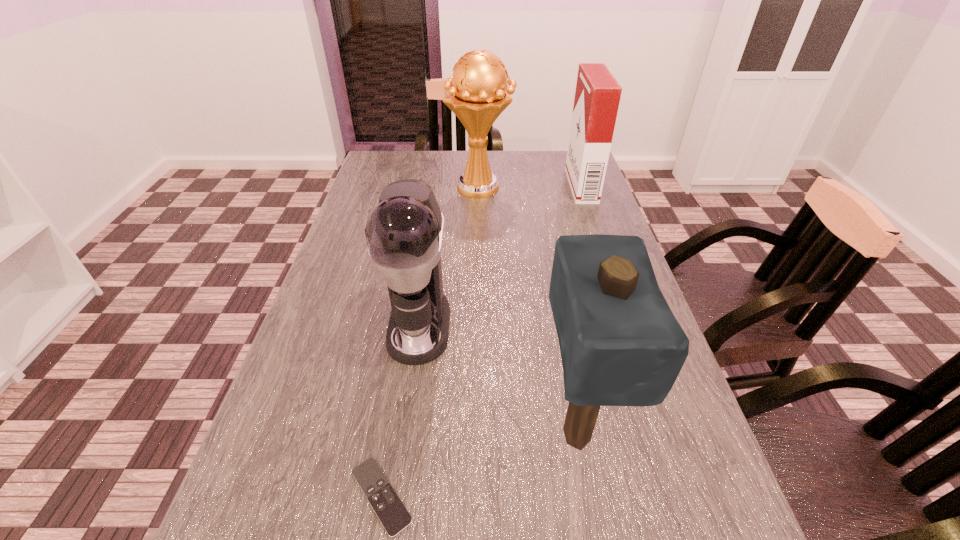
Identify the location of free point located place cup under the spout of the third farthest object. (395, 505).

This screenshot has width=960, height=540. What are the coordinates of `free space located on the right of the shortest object` in the screenshot? It's located at (567, 496).

I want to click on trophy_cup that is positioned at the far edge, so click(x=479, y=95).

At what (x,y) coordinates should I click in order to perform the action: click on cigarette_case present at the far edge. Please return your answer as a coordinate pair (x, y). Looking at the image, I should click on (597, 96).

Locate an element on the screen. This screenshot has height=540, width=960. mallet present at the right edge is located at coordinates (620, 344).

Where is `cigarette_case positioned at the right edge`? This screenshot has height=540, width=960. cigarette_case positioned at the right edge is located at coordinates (597, 96).

The height and width of the screenshot is (540, 960). I want to click on object that is positioned at the far right corner, so point(597,96).

Identify the location of free region at the far edge. This screenshot has width=960, height=540. (496, 151).

Image resolution: width=960 pixels, height=540 pixels. Identify the location of free region at the left edge of the desktop. (353, 284).

In the image, there is a desktop. Identify the location of free space at the right edge. (590, 225).